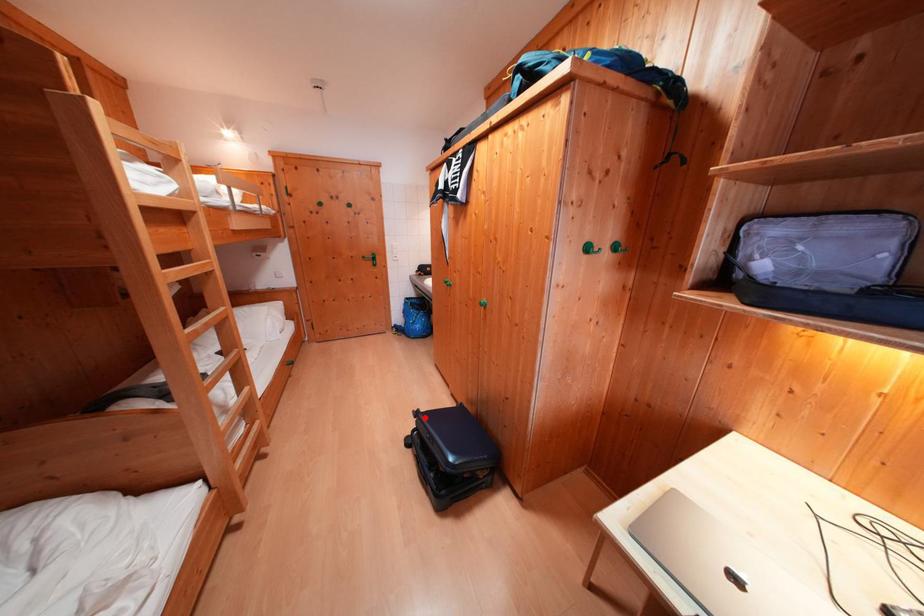
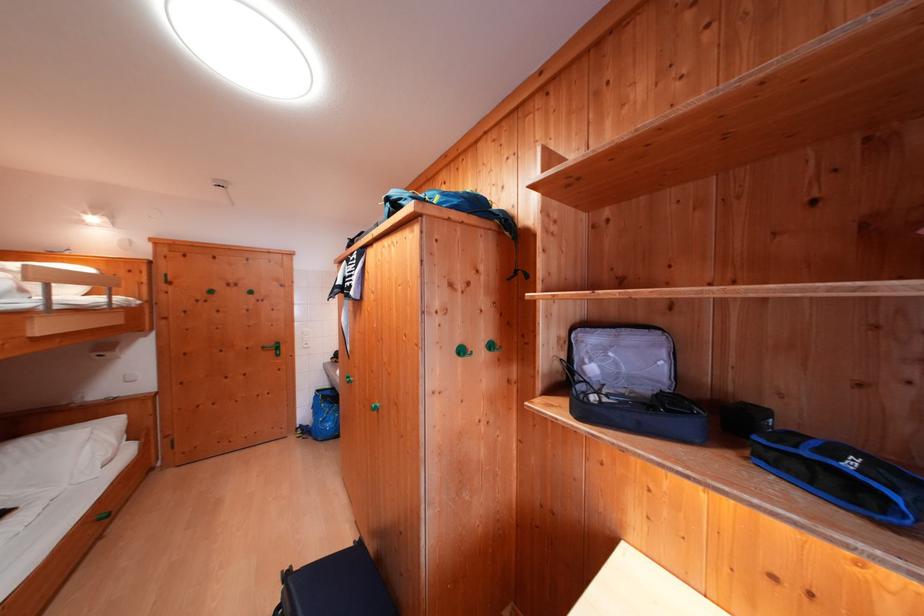
The point at the highlighted location is marked in the first image. Where is the corresponding point in the second image?

(296, 578)